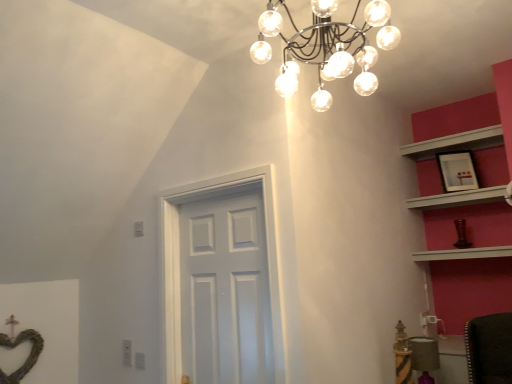
Question: Should I look upward or downward to see white glossy door at center?

Choices:
 (A) down
 (B) up

Answer: (A)

Question: Does white wooden shelf at upper right, positioned as the 1th shelf in bottom-to-top order, have a greater width compared to white glossy door at center?

Choices:
 (A) yes
 (B) no

Answer: (A)

Question: Is white wooden shelf at upper right, the second shelf positioned from the top, positioned with its back to white glossy door at center?

Choices:
 (A) no
 (B) yes

Answer: (A)

Question: Could white glossy door at center be considered to be inside white wooden shelf at upper right, positioned as the 1th shelf in bottom-to-top order?

Choices:
 (A) yes
 (B) no

Answer: (B)

Question: Is white wooden shelf at upper right, positioned as the 1th shelf in bottom-to-top order, bigger than white glossy door at center?

Choices:
 (A) no
 (B) yes

Answer: (A)

Question: Is white wooden shelf at upper right, the second shelf positioned from the top, not within white glossy door at center?

Choices:
 (A) no
 (B) yes

Answer: (B)

Question: Considering the relative sizes of white wooden shelf at upper right, positioned as the 1th shelf in bottom-to-top order, and white glossy door at center in the image provided, is white wooden shelf at upper right, positioned as the 1th shelf in bottom-to-top order, thinner than white glossy door at center?

Choices:
 (A) yes
 (B) no

Answer: (B)

Question: Is matte black picture frame at upper right wider than velvet purple chair at lower right?

Choices:
 (A) no
 (B) yes

Answer: (A)

Question: Does matte black picture frame at upper right lie in front of velvet purple chair at lower right?

Choices:
 (A) yes
 (B) no

Answer: (B)

Question: Is matte black picture frame at upper right directly adjacent to velvet purple chair at lower right?

Choices:
 (A) no
 (B) yes

Answer: (A)

Question: From a real-world perspective, does matte black picture frame at upper right sit lower than velvet purple chair at lower right?

Choices:
 (A) yes
 (B) no

Answer: (B)

Question: Would you say matte black picture frame at upper right contains velvet purple chair at lower right?

Choices:
 (A) no
 (B) yes

Answer: (A)

Question: Is matte black picture frame at upper right far away from velvet purple chair at lower right?

Choices:
 (A) no
 (B) yes

Answer: (B)

Question: Could you tell me if white glossy door at center is facing matte black picture frame at upper right?

Choices:
 (A) no
 (B) yes

Answer: (A)